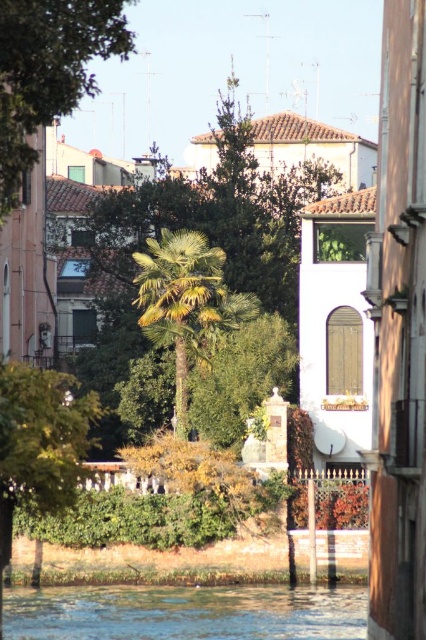
Question: Which of the following is the closest to the observer?

Choices:
 (A) green leafy tree at lower left
 (B) clear water at lower center

Answer: (A)

Question: Can you confirm if green leafy tree at upper left is positioned to the left of green leafy tree at lower left?

Choices:
 (A) yes
 (B) no

Answer: (A)

Question: Does green leafy tree at center appear on the right side of green leafy tree at upper left?

Choices:
 (A) no
 (B) yes

Answer: (B)

Question: Which is farther from the green leafy palm tree at center?

Choices:
 (A) green leafy tree at upper left
 (B) green leafy tree at lower left

Answer: (A)

Question: Is green leafy tree at center smaller than clear water at lower center?

Choices:
 (A) no
 (B) yes

Answer: (A)

Question: Which point is closer to the camera?

Choices:
 (A) (5, 499)
 (B) (106, 8)
 (C) (55, 600)
 (D) (163, 268)

Answer: (B)